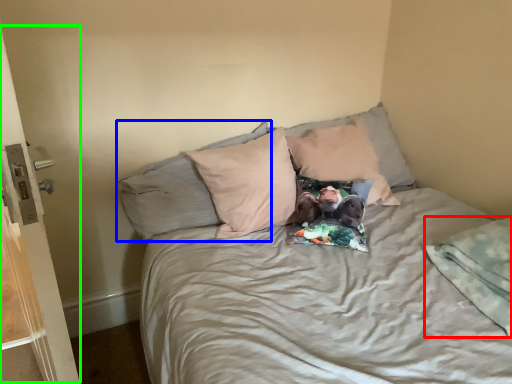
Question: Which object is the farthest from blanket (highlighted by a red box)? Choose among these: pillow (highlighted by a blue box) or screen door (highlighted by a green box).

Choices:
 (A) pillow
 (B) screen door

Answer: (B)